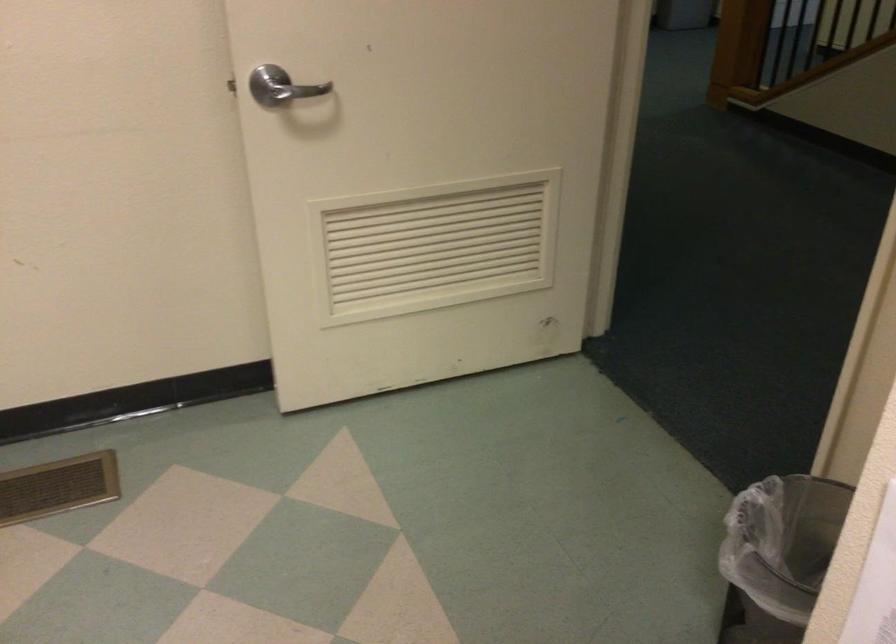
Locate an element on the screen. Image resolution: width=896 pixels, height=644 pixels. metal floor vent is located at coordinates (57, 487).